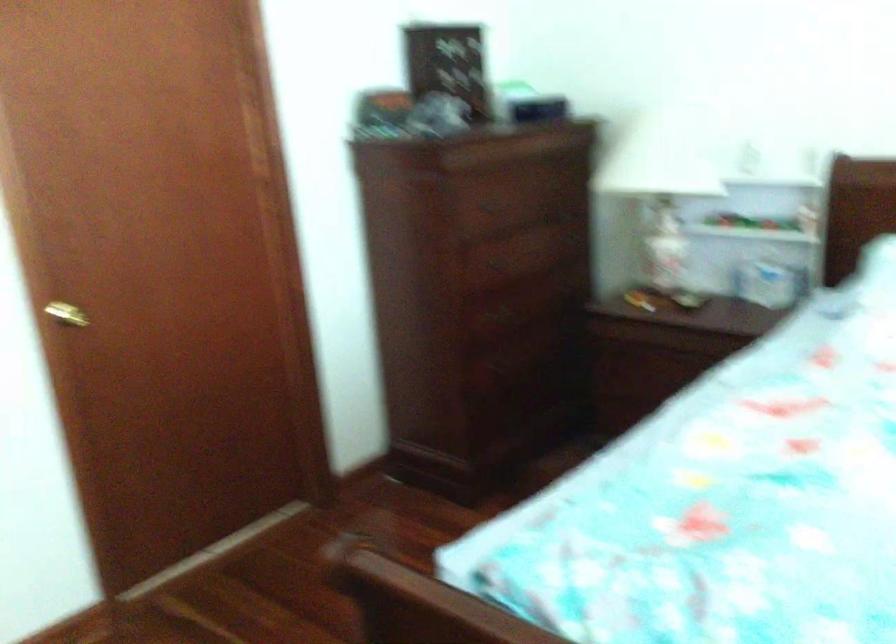
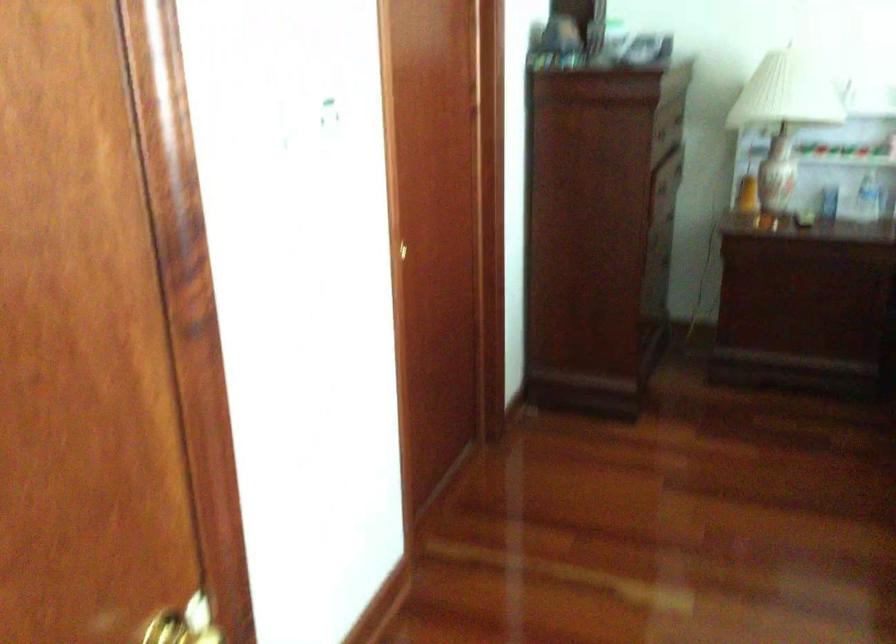
Find the pixel in the second image that matches point (149, 301) in the first image.

(408, 250)